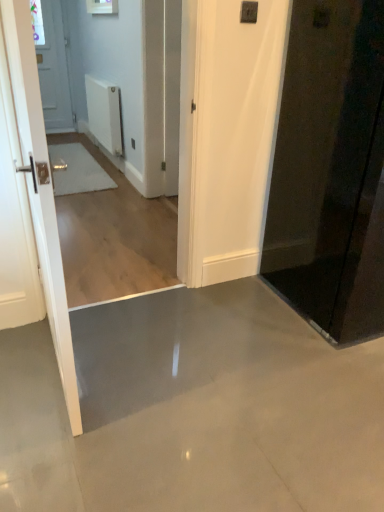
Question: Could you tell me if black glossy door at right, the 2th door in the left-to-right sequence, is facing white matte radiator at upper center?

Choices:
 (A) no
 (B) yes

Answer: (A)

Question: From a real-world perspective, is black glossy door at right, the first door in the right-to-left sequence, positioned over white matte radiator at upper center based on gravity?

Choices:
 (A) yes
 (B) no

Answer: (A)

Question: Is black glossy door at right, the first door in the right-to-left sequence, thinner than white matte radiator at upper center?

Choices:
 (A) yes
 (B) no

Answer: (B)

Question: Are black glossy door at right, the first door in the right-to-left sequence, and white matte radiator at upper center making contact?

Choices:
 (A) yes
 (B) no

Answer: (B)

Question: Is white matte radiator at upper center completely or partially inside black glossy door at right, the first door in the right-to-left sequence?

Choices:
 (A) yes
 (B) no

Answer: (B)

Question: Considering the positions of white matte radiator at upper center and white glossy door at left, arranged as the 1th door when viewed from the left, in the image, is white matte radiator at upper center bigger or smaller than white glossy door at left, arranged as the 1th door when viewed from the left,?

Choices:
 (A) small
 (B) big

Answer: (A)

Question: Considering their positions, is white matte radiator at upper center located in front of or behind white glossy door at left, arranged as the 2th door when viewed from the right?

Choices:
 (A) front
 (B) behind

Answer: (B)

Question: Is point (94, 112) positioned closer to the camera than point (26, 161)?

Choices:
 (A) closer
 (B) farther

Answer: (B)

Question: From a real-world perspective, is white matte radiator at upper center physically located above or below white glossy door at left, arranged as the 2th door when viewed from the right?

Choices:
 (A) below
 (B) above

Answer: (A)

Question: Based on their sizes in the image, would you say white glossy door at left, arranged as the 1th door when viewed from the left, is bigger or smaller than black glossy door at right, the 2th door in the left-to-right sequence?

Choices:
 (A) small
 (B) big

Answer: (A)

Question: From a real-world perspective, relative to black glossy door at right, the 2th door in the left-to-right sequence, is white glossy door at left, arranged as the 2th door when viewed from the right, vertically above or below?

Choices:
 (A) above
 (B) below

Answer: (B)

Question: Is white glossy door at left, arranged as the 1th door when viewed from the left, inside or outside of black glossy door at right, the 2th door in the left-to-right sequence?

Choices:
 (A) inside
 (B) outside

Answer: (B)

Question: Visually, is white glossy door at left, arranged as the 2th door when viewed from the right, positioned to the left or to the right of black glossy door at right, the 2th door in the left-to-right sequence?

Choices:
 (A) right
 (B) left

Answer: (B)

Question: In the image, is black glossy door at right, the first door in the right-to-left sequence, on the left side or the right side of white matte radiator at upper center?

Choices:
 (A) left
 (B) right

Answer: (B)

Question: In terms of size, does black glossy door at right, the first door in the right-to-left sequence, appear bigger or smaller than white matte radiator at upper center?

Choices:
 (A) big
 (B) small

Answer: (A)